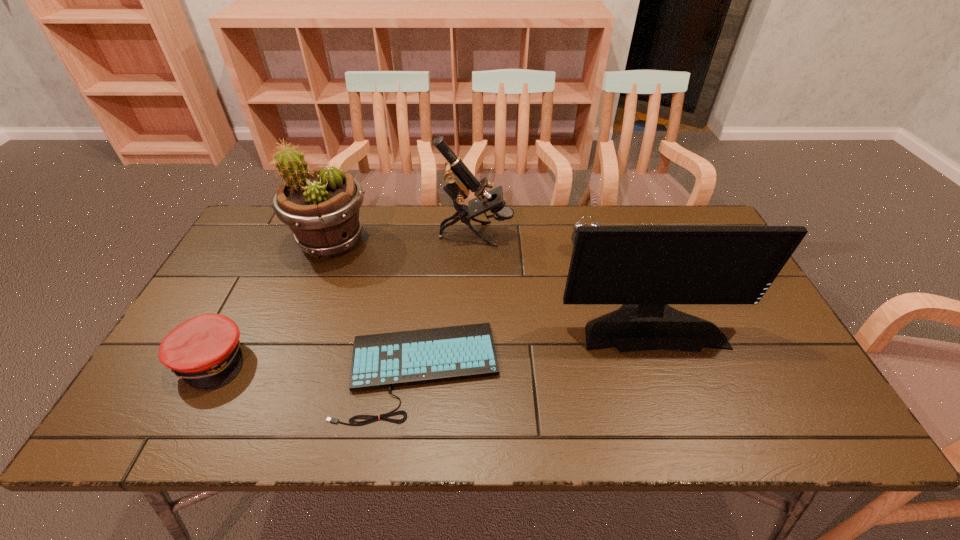
Find the location of a particular element. Image resolution: width=960 pixels, height=540 pixels. flowerpot is located at coordinates (321, 207).

Where is `microscope`? The width and height of the screenshot is (960, 540). microscope is located at coordinates (459, 179).

Find the location of a particular element. The width and height of the screenshot is (960, 540). monitor is located at coordinates (645, 268).

At what (x,y) coordinates should I click in order to perform the action: click on alarm clock. Please return your answer as a coordinate pair (x, y). This screenshot has height=540, width=960. Looking at the image, I should click on (579, 223).

Image resolution: width=960 pixels, height=540 pixels. I want to click on cap, so click(x=204, y=351).

This screenshot has width=960, height=540. Find the location of `the shortest object`. the shortest object is located at coordinates (386, 360).

At what (x,y) coordinates should I click in order to perform the action: click on vacant space located on the front of the flowerpot. Please return your answer as a coordinate pair (x, y). Looking at the image, I should click on (281, 373).

The height and width of the screenshot is (540, 960). Identify the location of vacant space located 0.130m through the eyepiece of the microscope. (553, 234).

This screenshot has width=960, height=540. What are the coordinates of `vacant area located 0.140m on the screen side of the monitor` in the screenshot? It's located at pyautogui.click(x=680, y=404).

Where is `vacant position located 0.370m on the face of the alarm clock`? This screenshot has height=540, width=960. vacant position located 0.370m on the face of the alarm clock is located at coordinates (612, 358).